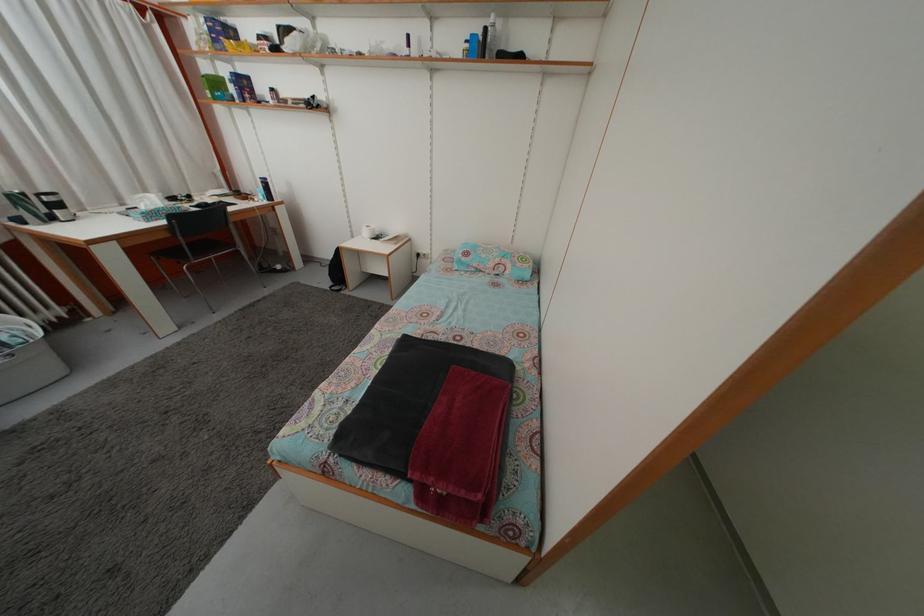
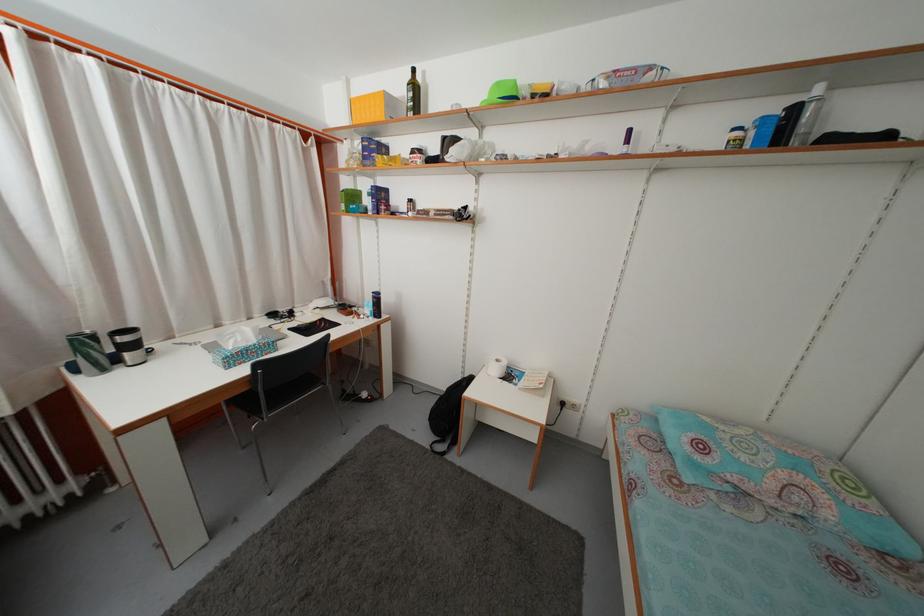
Which direction would the cameraman need to move to produce the second image?

The movement direction of the cameraman is left, forward.